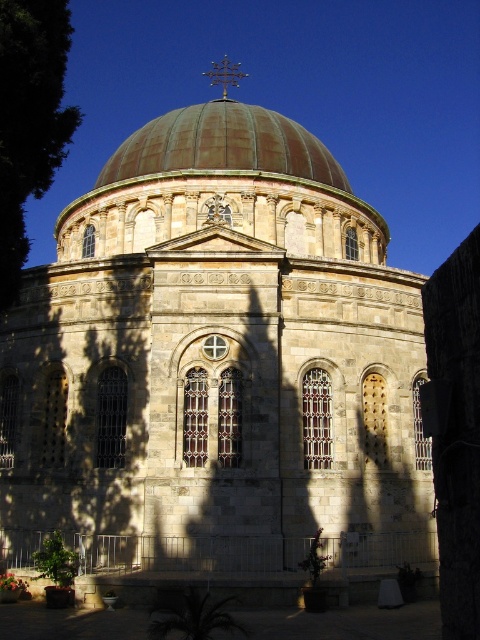
Question: Is bronze/golden dome at center smaller than green leafy tree at left?

Choices:
 (A) yes
 (B) no

Answer: (B)

Question: Is bronze/golden dome at center thinner than green leafy tree at left?

Choices:
 (A) no
 (B) yes

Answer: (A)

Question: Which object is farther from the camera taking this photo?

Choices:
 (A) bronze/golden dome at center
 (B) green leafy tree at left

Answer: (A)

Question: Can you confirm if bronze/golden dome at center is positioned to the left of green leafy tree at left?

Choices:
 (A) no
 (B) yes

Answer: (B)